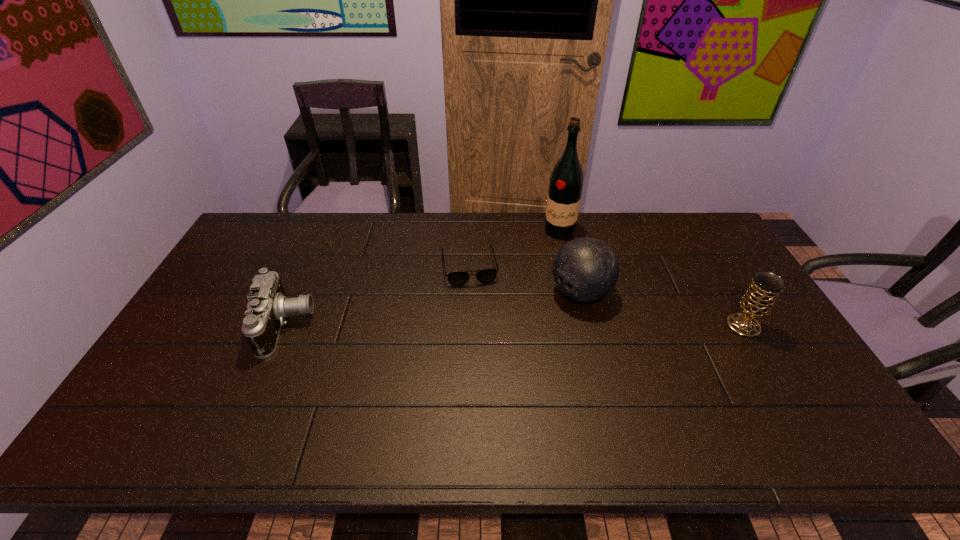
Image resolution: width=960 pixels, height=540 pixels. Identify the location of the leftmost object. (268, 306).

You are a GUI agent. You are given a task and a screenshot of the screen. Output one action in this format:
    pyautogui.click(x=<x>, y=<y>)
    Task: Click on the second shortest object
    The height and width of the screenshot is (540, 960).
    Given the screenshot: What is the action you would take?
    pyautogui.click(x=268, y=306)

At what (x,y) coordinates should I click in order to perform the action: click on the rightmost object. Please return your answer as a coordinate pair (x, y). Looking at the image, I should click on (758, 300).

Find the location of a particular element. This screenshot has height=540, width=960. bowling ball is located at coordinates (585, 269).

This screenshot has height=540, width=960. Identify the location of the second object from left to right. (485, 276).

At what (x,y) coordinates should I click in order to perform the action: click on the shortest object. Please return your answer as a coordinate pair (x, y). This screenshot has height=540, width=960. Looking at the image, I should click on pyautogui.click(x=485, y=276).

You are a GUI agent. You are given a task and a screenshot of the screen. Output one action in this format:
    pyautogui.click(x=<x>, y=<y>)
    Task: Click on the farthest object
    The height and width of the screenshot is (540, 960).
    Given the screenshot: What is the action you would take?
    pyautogui.click(x=566, y=181)

At what (x,y) coordinates should I click in order to perform the action: click on liquor. Please return your answer as a coordinate pair (x, y). The height and width of the screenshot is (540, 960). Looking at the image, I should click on (566, 181).

The image size is (960, 540). What are the coordinates of `free space located 0.250m at the lens of the leftmost object` in the screenshot? It's located at (401, 326).

You are a GUI agent. You are given a task and a screenshot of the screen. Output one action in this format:
    pyautogui.click(x=<x>, y=<y>)
    Task: Click on the free space located 0.260m on the back of the chalice
    Image resolution: width=960 pixels, height=540 pixels.
    Given the screenshot: What is the action you would take?
    pyautogui.click(x=704, y=259)